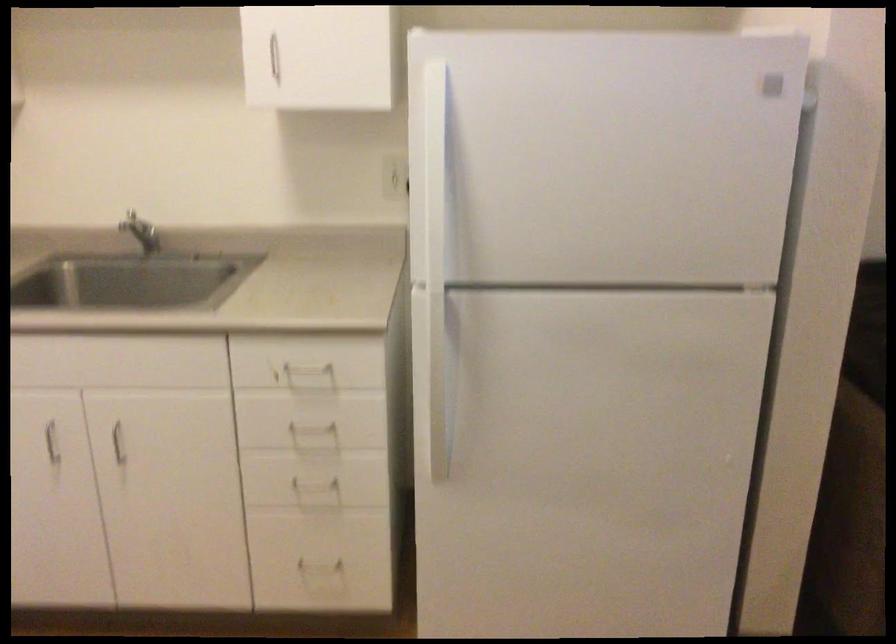
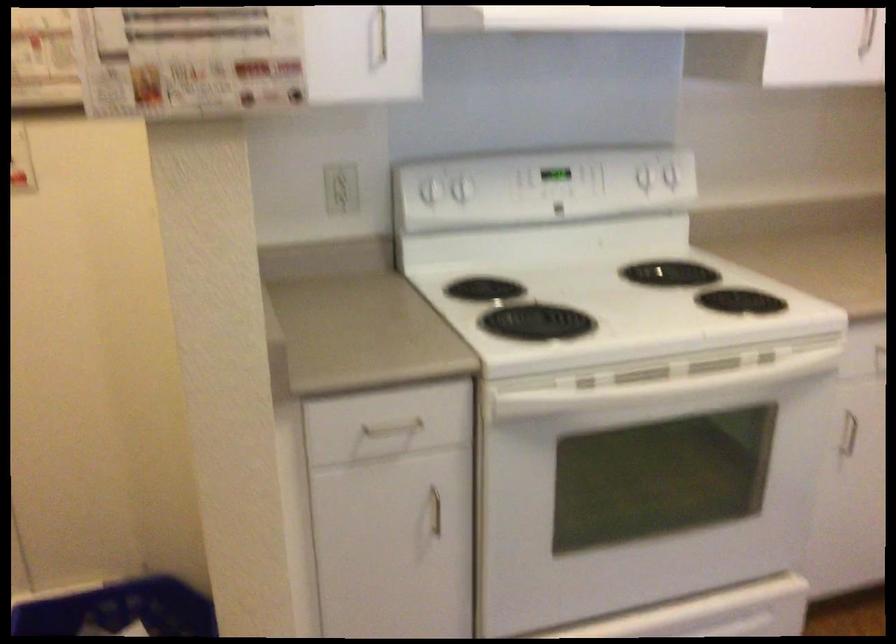
Question: The camera is either moving clockwise (left) or counter-clockwise (right) around the object. The first image is from the beginning of the video and the second image is from the end. Is the camera moving left or right when shooting the video?

Choices:
 (A) Left
 (B) Right

Answer: (B)